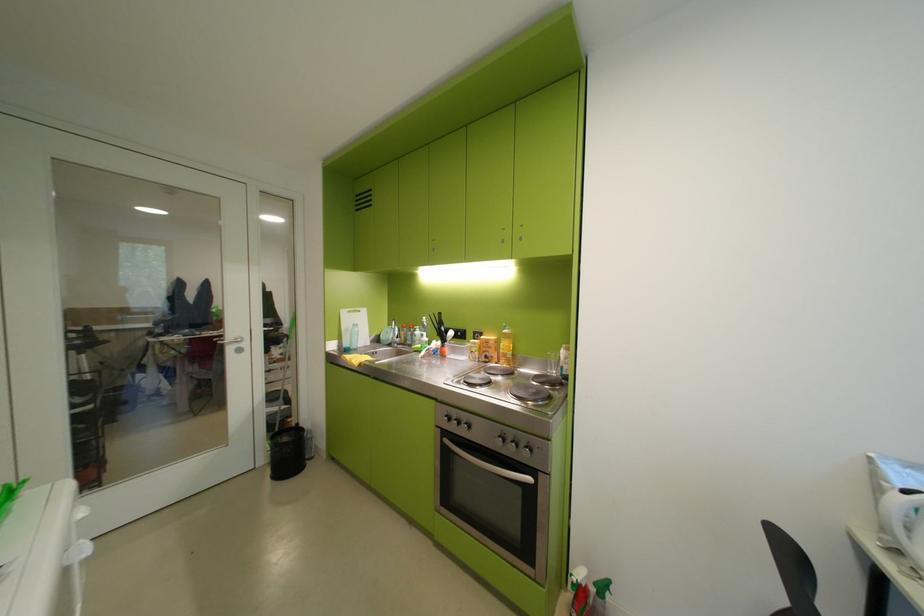
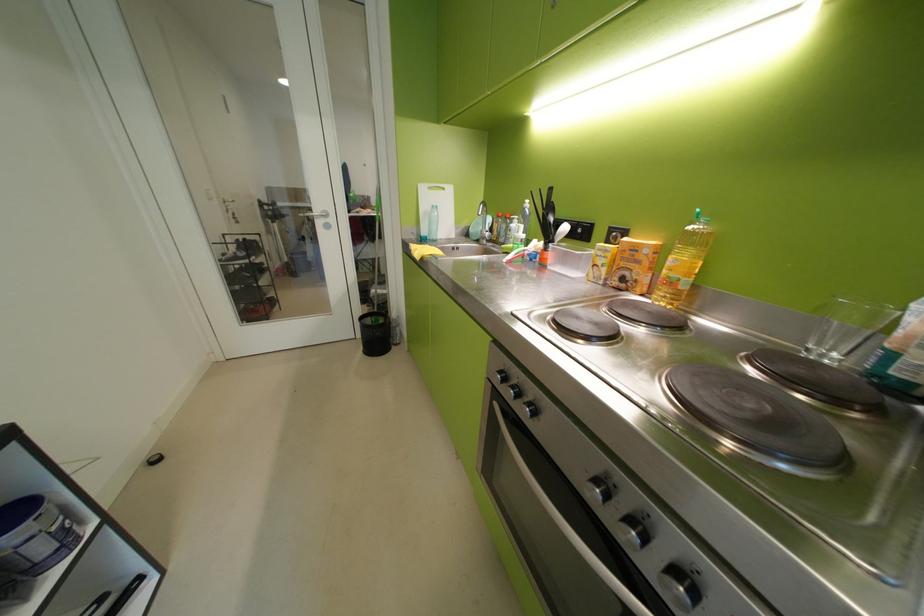
The point at [515,355] is marked in the first image. Where is the corresponding point in the second image?

(681, 284)